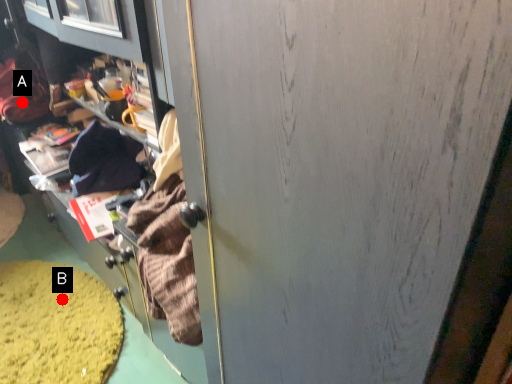
Question: Two points are circled on the image, labeled by A and B beside each circle. Which point appears closest to the camera in this image?

Choices:
 (A) A is closer
 (B) B is closer

Answer: (B)